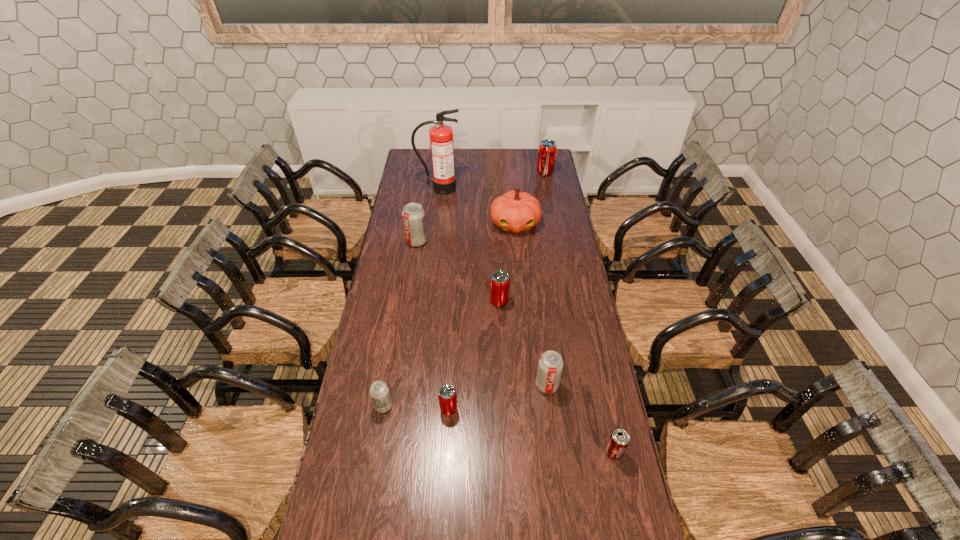
I want to click on free location located on the left of the second farthest red soda can, so click(409, 301).

Image resolution: width=960 pixels, height=540 pixels. What are the coordinates of `vacant space located 0.130m on the left of the nearest red soda can` in the screenshot? It's located at (402, 409).

The width and height of the screenshot is (960, 540). Identify the location of vacant position located on the right of the nearest gray soda can. (454, 406).

Where is `vacant space located 0.390m on the left of the beer can`? The image size is (960, 540). vacant space located 0.390m on the left of the beer can is located at coordinates (482, 453).

Find the location of a particular element. The height and width of the screenshot is (540, 960). object positioned at the far edge is located at coordinates (547, 149).

Identify the location of fire extinguisher that is at the left edge. The image size is (960, 540). (441, 136).

Locate an element on the screen. This screenshot has height=540, width=960. pumpkin at the right edge is located at coordinates (515, 211).

Find the location of a particular element. This screenshot has height=540, width=960. soda can that is at the right edge is located at coordinates (547, 149).

Locate an element on the screen. The width and height of the screenshot is (960, 540). beer can situated at the right edge is located at coordinates (619, 440).

Where is `object at the far right corner`? The image size is (960, 540). object at the far right corner is located at coordinates (547, 149).